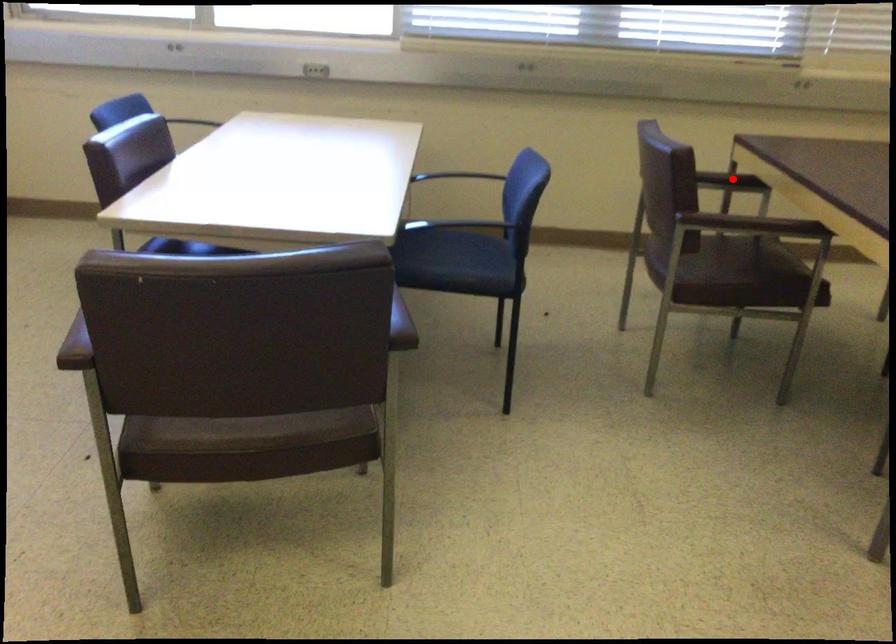
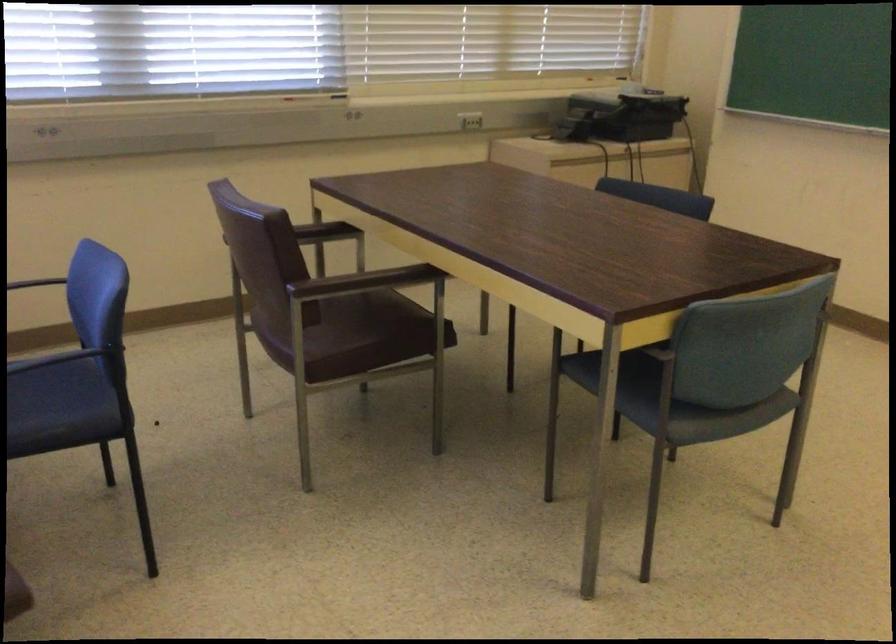
Find the pixel in the second image that matches the highlighted location in the first image.

(323, 232)